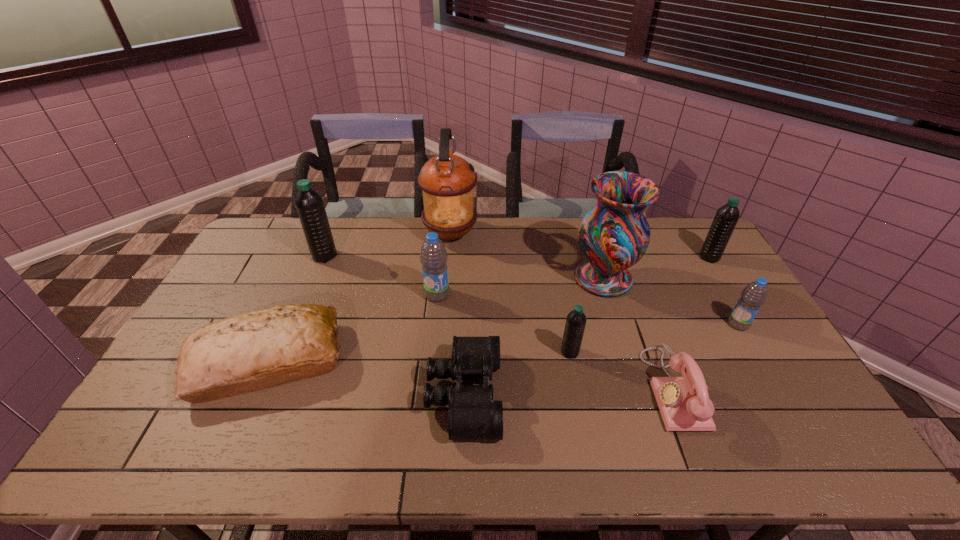
You are a GUI agent. You are given a task and a screenshot of the screen. Output one action in this format:
    pyautogui.click(x=<x>, y=<y>)
    Task: Click on the free region located 0.180m on the back of the nearest black water bottle
    Image resolution: width=960 pixels, height=540 pixels.
    Given the screenshot: What is the action you would take?
    pyautogui.click(x=560, y=301)

You are a GUI agent. You are given a task and a screenshot of the screen. Output one action in this format:
    pyautogui.click(x=<x>, y=<y>)
    Task: Click on the free space located 0.320m on the left of the right blue water bottle
    The image size is (960, 540).
    Given the screenshot: What is the action you would take?
    pyautogui.click(x=622, y=324)

What are the coordinates of `free spot located 0.060m on the back of the bread` in the screenshot? It's located at pos(293,306).

What are the coordinates of `vacant area situated 0.280m on the dial of the pink telephone` in the screenshot? It's located at click(544, 388).

This screenshot has width=960, height=540. I want to click on free space located 0.210m on the dial of the pink telephone, so click(570, 388).

Where is `free location located 0.360m on the dial of the pink telephone`? free location located 0.360m on the dial of the pink telephone is located at coordinates (514, 388).

Find the location of `free region located at the eyepieces of the shortest object`. free region located at the eyepieces of the shortest object is located at coordinates click(550, 394).

At what (x,y) coordinates should I click in order to perform the action: click on oil lamp that is at the far edge. Please return your answer as a coordinate pair (x, y). The image size is (960, 540). Looking at the image, I should click on (447, 181).

Where is `telephone at the near edge`? Image resolution: width=960 pixels, height=540 pixels. telephone at the near edge is located at coordinates tap(684, 403).

At what (x,y) coordinates should I click in order to perform the action: click on binoculars present at the near edge. Please return your answer as a coordinate pair (x, y). The height and width of the screenshot is (540, 960). Looking at the image, I should click on (473, 414).